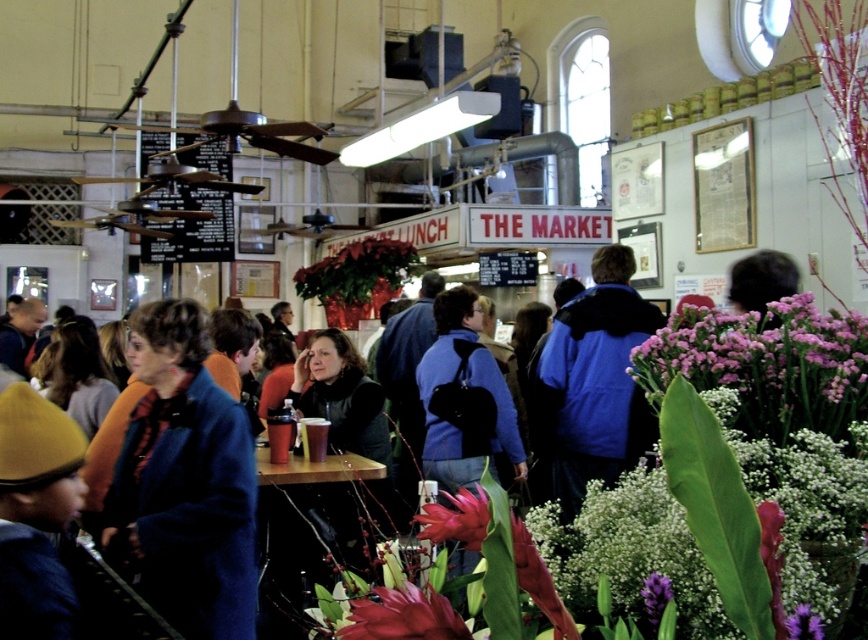
You are a customer at THE MARKET and want to buy the purple matte flowers at center and the purple matte flower at lower center. If you stand facing the flowers, which one would block your view of the other?

The purple matte flowers at center is in front of the purple matte flower at lower center, so the purple matte flowers at center would block the view of the purple matte flower at lower center.

You are a florist arranging a bouquet and need to choose between the purple matte flowers at center and the purple matte flower at lower center. Which one is taller?

The purple matte flowers at center is taller than the purple matte flower at lower center.

You are standing in the bustling indoor market and want to take a photo of both the point at coordinates (x=753, y=356) and the point at coordinates (x=852, y=401). Which point should you focus on first to ensure both are in clear view?

You should focus on point (x=753, y=356) first because it is closer to the camera than point (x=852, y=401). By focusing on the closer point, both points will be in clear view due to the depth of field.